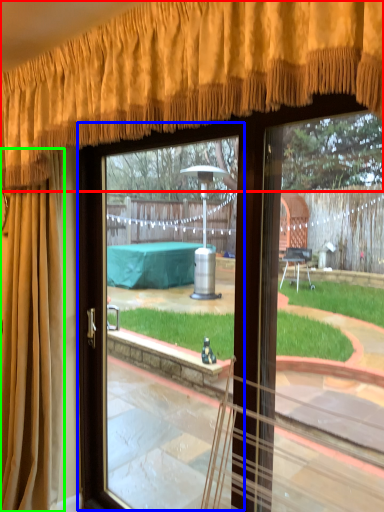
Question: Which is farther away from curtain (highlighted by a red box)? screen door (highlighted by a blue box) or curtain (highlighted by a green box)?

Choices:
 (A) screen door
 (B) curtain

Answer: (A)